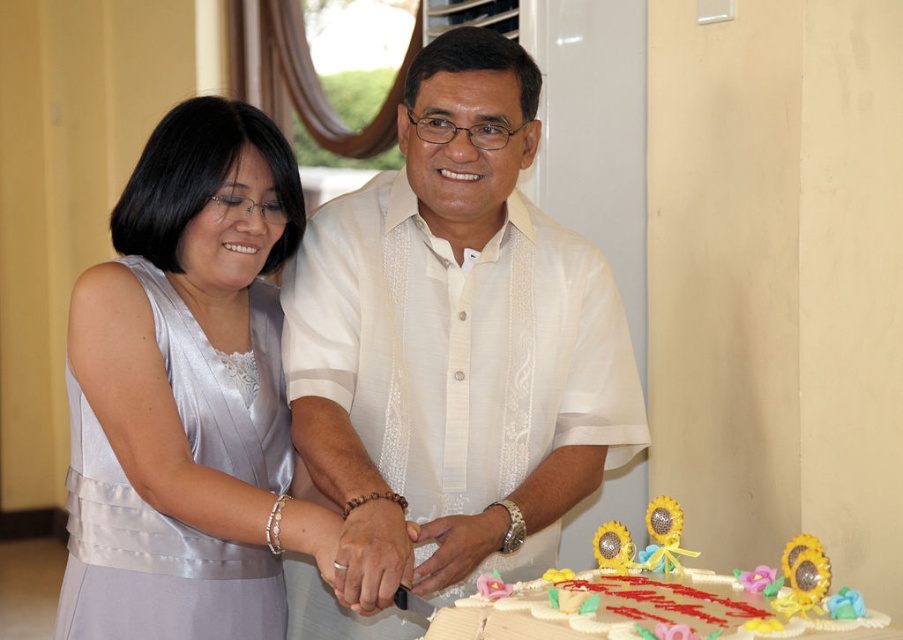
What do you see at coordinates (449, 353) in the screenshot?
I see `white sheer shirt at center` at bounding box center [449, 353].

Can you confirm if white sheer shirt at center is positioned above satin dress at left?

Yes.

Locate an element on the screen. white sheer shirt at center is located at coordinates (449, 353).

Does satin dress at left appear on the left side of white fondant cake at lower center?

Yes, satin dress at left is to the left of white fondant cake at lower center.

What are the coordinates of `satin dress at left` in the screenshot? It's located at (185, 394).

Who is more distant from viewer, (165, 388) or (612, 524)?

Positioned behind is point (165, 388).

Identify the location of satin dress at left. (185, 394).

Consider the image. Who is lower down, white sheer shirt at center or white fondant cake at lower center?

white fondant cake at lower center is below.

Is white sheer shirt at center wider than white fondant cake at lower center?

Yes, white sheer shirt at center is wider than white fondant cake at lower center.

Find the location of `white sheer shirt at center`. white sheer shirt at center is located at coordinates (449, 353).